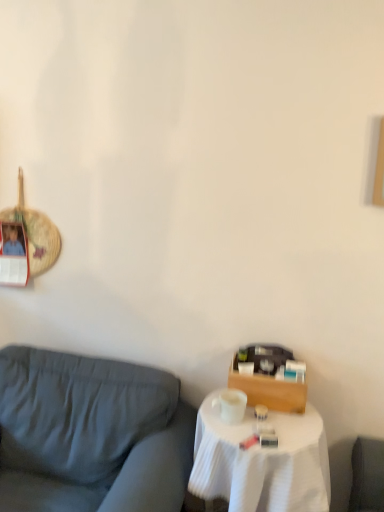
Question: In the image, is matte gray fabric couch at left positioned in front of or behind white cloth-covered table at lower right?

Choices:
 (A) behind
 (B) front

Answer: (B)

Question: From their relative heights in the image, would you say matte gray fabric couch at left is taller or shorter than white cloth-covered table at lower right?

Choices:
 (A) tall
 (B) short

Answer: (A)

Question: In terms of size, does matte gray fabric couch at left appear bigger or smaller than white cloth-covered table at lower right?

Choices:
 (A) small
 (B) big

Answer: (B)

Question: From the image's perspective, is white cloth-covered table at lower right located above or below matte gray fabric couch at left?

Choices:
 (A) above
 (B) below

Answer: (B)

Question: Considering the positions of white cloth-covered table at lower right and matte gray fabric couch at left in the image, is white cloth-covered table at lower right bigger or smaller than matte gray fabric couch at left?

Choices:
 (A) small
 (B) big

Answer: (A)

Question: Is white cloth-covered table at lower right in front of or behind matte gray fabric couch at left in the image?

Choices:
 (A) front
 (B) behind

Answer: (B)

Question: From their relative heights in the image, would you say white cloth-covered table at lower right is taller or shorter than matte gray fabric couch at left?

Choices:
 (A) short
 (B) tall

Answer: (A)